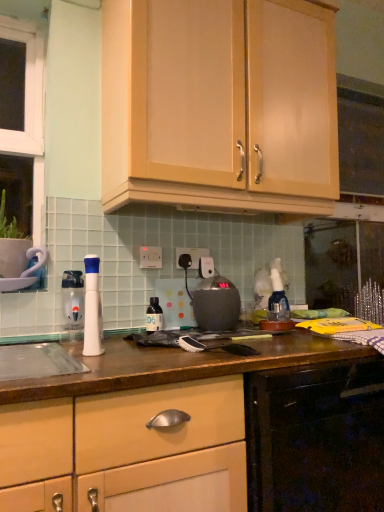
Question: From their relative heights in the image, would you say matte black kettle at center is taller or shorter than wooden drawer at center, placed as the second cabinetry when sorted from top to bottom?

Choices:
 (A) tall
 (B) short

Answer: (B)

Question: From a real-world perspective, is matte black kettle at center above or below wooden drawer at center, the 1th cabinetry ordered from the bottom?

Choices:
 (A) below
 (B) above

Answer: (B)

Question: Which object is the farthest from the matte black kettle at center?

Choices:
 (A) translucent plastic bottle at center, which is the 2th bottle in front-to-back order
 (B) wooden drawer at center, the 1th cabinetry ordered from the bottom
 (C) matte wood cabinet at upper center, the 2th cabinetry in the bottom-to-top sequence
 (D) white plastic electric outlet at center, arranged as the 1th electric outlet when viewed from the left
 (E) white plastic electric outlet at center, which is counted as the second electric outlet, starting from the left

Answer: (C)

Question: Estimate the real-world distances between objects in this image. Which object is closer to the wooden drawer at center, the 1th cabinetry ordered from the bottom?

Choices:
 (A) matte wood cabinet at upper center, the 2th cabinetry in the bottom-to-top sequence
 (B) translucent plastic bottle at left, the 1th bottle in the front-to-back sequence
 (C) matte black kettle at center
 (D) translucent plastic bottle at center, acting as the first bottle starting from the right
 (E) white plastic electric outlet at center, placed as the 1th electric outlet when sorted from back to front

Answer: (C)